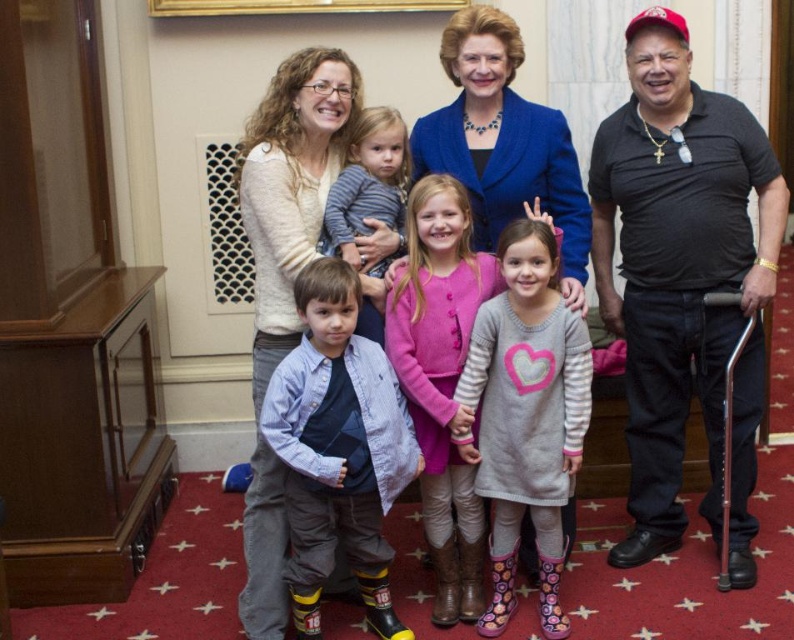
You are standing in the room where the group is posing. You need to find the black matte shirt at right. Where would you look to find it?

The black matte shirt at right is located at the 2D coordinates point (677, 262) in the image.

From the picture: You are a photographer trying to capture a closeup of the blue denim shirt at center and the striped cotton shirt at center. Which one should you focus on first if you want to start with the one closer to the camera?

The blue denim shirt at center is located below the striped cotton shirt at center, so it is closer to the camera. Therefore, you should focus on the blue denim shirt at center first.